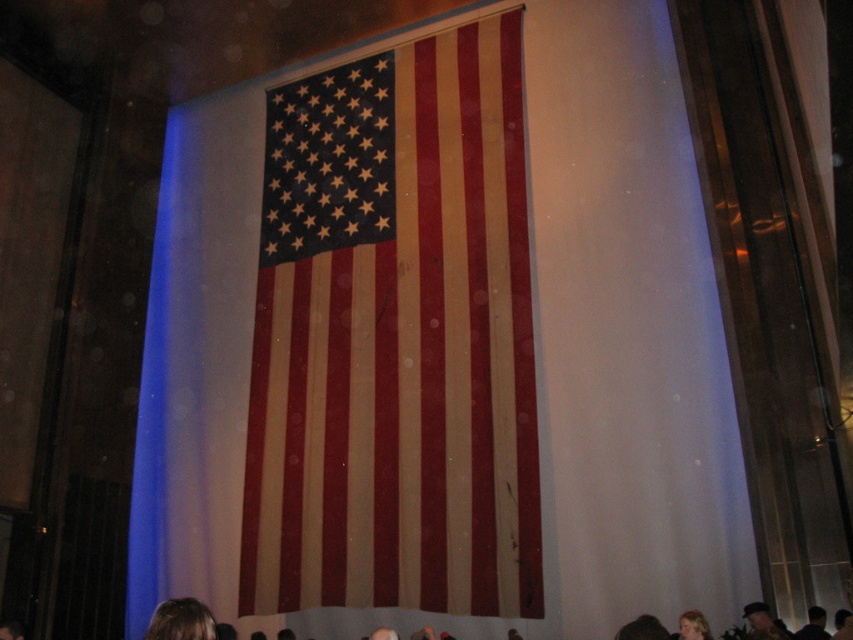
Does blonde hair at lower left have a greater height compared to dark brown hair at lower center?

In fact, blonde hair at lower left may be shorter than dark brown hair at lower center.

Is blonde hair at lower left further to the viewer compared to dark brown hair at lower center?

That is False.

Measure the distance between blonde hair at lower left and camera.

They are 9.07 feet apart.

This screenshot has width=853, height=640. I want to click on blonde hair at lower left, so click(x=181, y=620).

Can you confirm if matte fabric flag at center is smaller than blonde hair at lower left?

Actually, matte fabric flag at center might be larger than blonde hair at lower left.

Can you confirm if matte fabric flag at center is wider than blonde hair at lower left?

Yes.

Does point (297, 557) come farther from viewer compared to point (164, 614)?

Yes, it is behind point (164, 614).

The height and width of the screenshot is (640, 853). I want to click on matte fabric flag at center, so click(395, 339).

Who is shorter, camouflage fabric cap at lower right or blonde hair at lower center?

blonde hair at lower center

Between point (749, 609) and point (689, 627), which one is positioned behind?

Positioned behind is point (749, 609).

Locate an element on the screen. This screenshot has width=853, height=640. camouflage fabric cap at lower right is located at coordinates (761, 621).